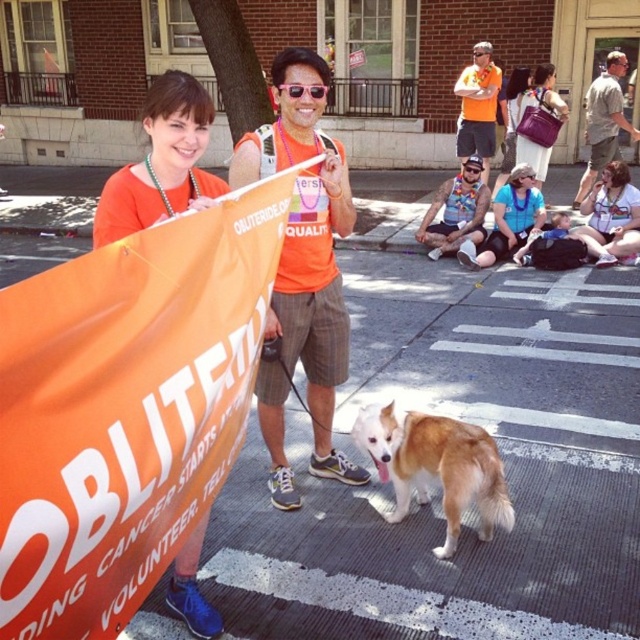
What do you see at coordinates (436, 467) in the screenshot? I see `brown and white fur dog at center` at bounding box center [436, 467].

Does brown and white fur dog at center appear over black plastic goggles at center?

No.

Is point (492, 522) more distant than point (474, 172)?

No.

The image size is (640, 640). Identify the location of brown and white fur dog at center. (436, 467).

Measure the distance between orange fabric banner at center and black plastic goggles at center.

orange fabric banner at center is 6.88 meters away from black plastic goggles at center.

Locate an element on the screen. The image size is (640, 640). orange fabric banner at center is located at coordinates (125, 408).

The height and width of the screenshot is (640, 640). What are the coordinates of `orange fabric banner at center` in the screenshot? It's located at (125, 408).